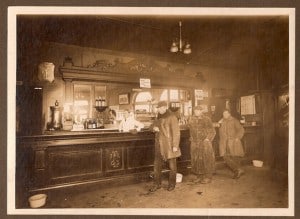
At what (x,y) coordinates should I click in order to perform the action: click on scrollwork. Please return your answer as a coordinate pair (x, y). This screenshot has height=219, width=300. Looking at the image, I should click on (148, 68), (113, 158).